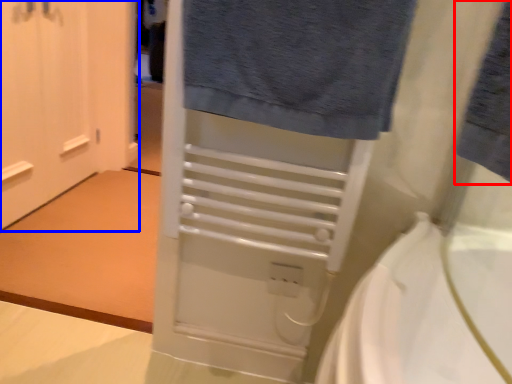
Question: Among these objects, which one is nearest to the camera, bath towel (highlighted by a red box) or door (highlighted by a blue box)?

Choices:
 (A) bath towel
 (B) door

Answer: (A)